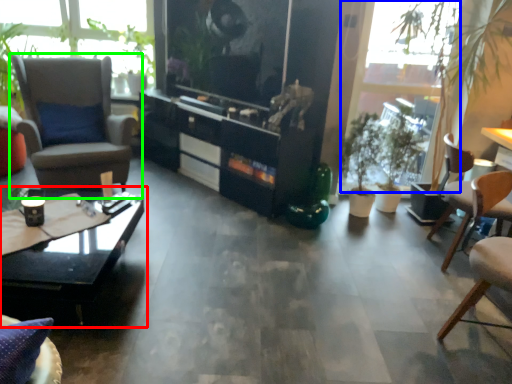
Question: Estimate the real-world distances between objects in this image. Which object is farther from coffee table (highlighted by a red box), window screen (highlighted by a blue box) or chair (highlighted by a green box)?

Choices:
 (A) window screen
 (B) chair

Answer: (A)